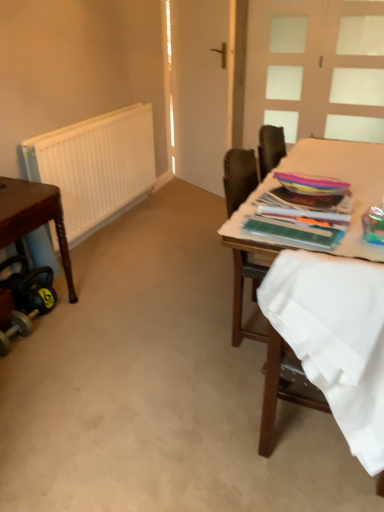
The width and height of the screenshot is (384, 512). What are the coordinates of `vacant area on top of wooden chair at right (from a real-world perspective)` in the screenshot? It's located at (350, 168).